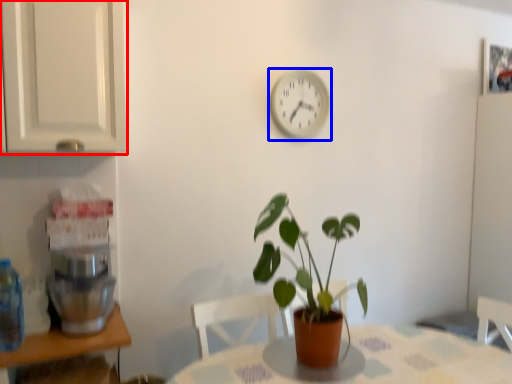
Question: Which object appears closest to the camera in this image, cabinetry (highlighted by a red box) or clock (highlighted by a blue box)?

Choices:
 (A) cabinetry
 (B) clock

Answer: (A)